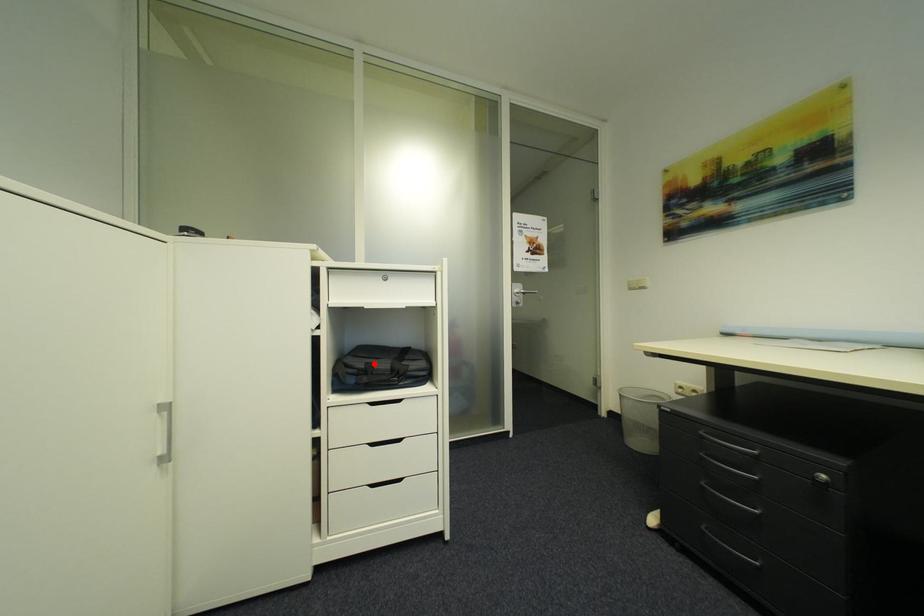
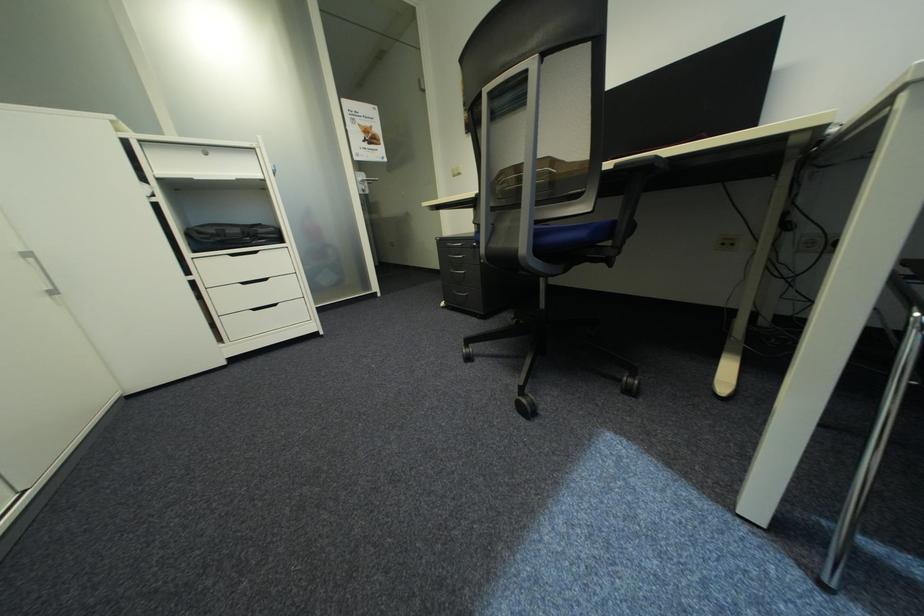
The point at the highlighted location is marked in the first image. Where is the corresponding point in the second image?

(225, 230)